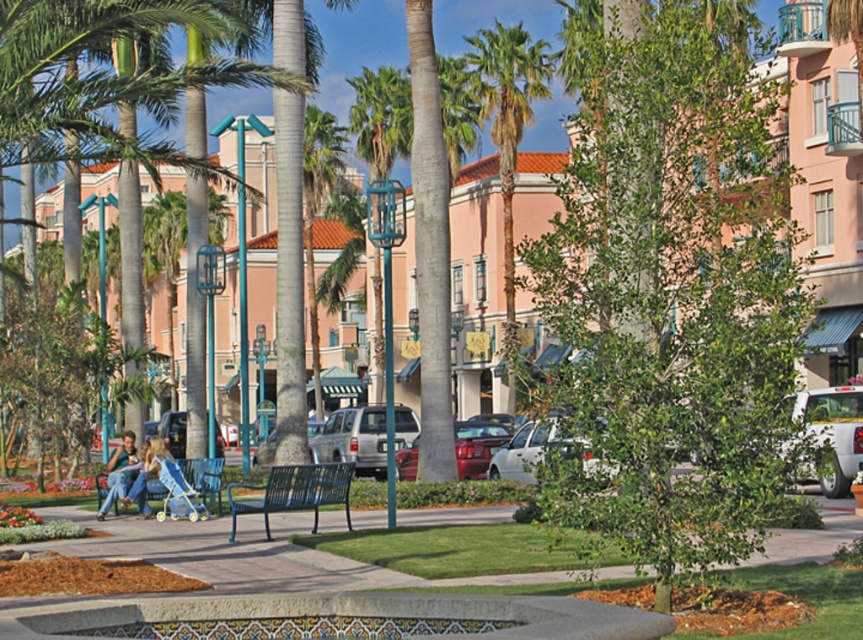
Question: Which point appears farthest from the camera in this image?

Choices:
 (A) (646, 29)
 (B) (127, 452)

Answer: (B)

Question: Can you confirm if green leafy palm tree at center is positioned to the right of white glossy car at lower right?

Choices:
 (A) no
 (B) yes

Answer: (A)

Question: Can you confirm if silver metallic suv at center is thinner than metallic blue bench at lower left?

Choices:
 (A) yes
 (B) no

Answer: (B)

Question: Which is farther from the green leafy palm tree at center?

Choices:
 (A) white glossy car at lower right
 (B) metallic blue bench at lower left
 (C) matte blue jeans at center

Answer: (B)

Question: From the image, what is the correct spatial relationship of silver metallic suv at center in relation to metallic silver car at center?

Choices:
 (A) left
 (B) right

Answer: (A)

Question: Among these objects, which one is farthest from the camera?

Choices:
 (A) green leafy tree at center
 (B) shiny red car at center
 (C) green leafy palm tree at center

Answer: (B)